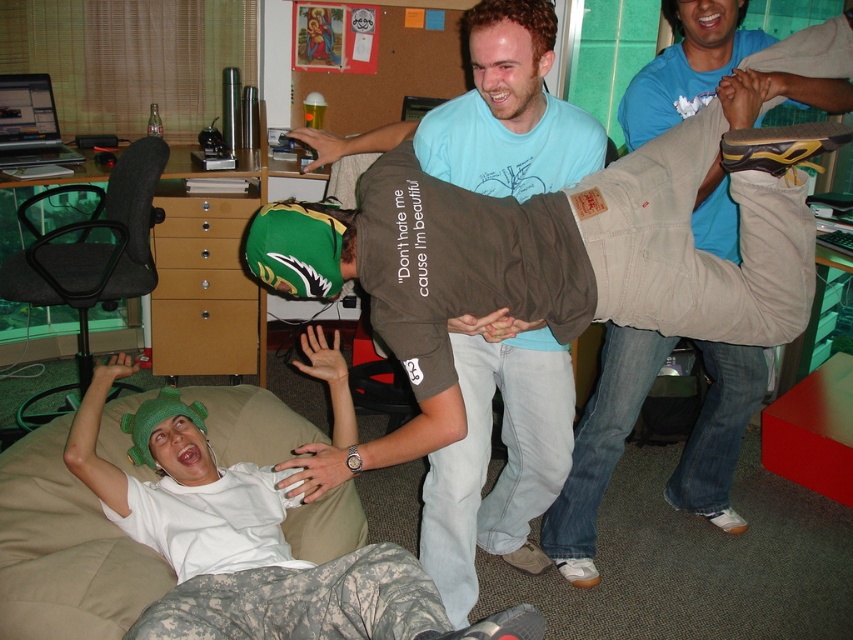
Question: Which object is farther from the camera taking this photo?

Choices:
 (A) beige fabric couch at lower left
 (B) khaki cotton pants at center
 (C) dark gray fabric bean bag chair at left

Answer: (C)

Question: Does khaki cotton pants at center appear on the left side of dark gray fabric bean bag chair at left?

Choices:
 (A) no
 (B) yes

Answer: (A)

Question: Does beige fabric couch at lower left have a larger size compared to dark gray fabric bean bag chair at left?

Choices:
 (A) no
 (B) yes

Answer: (A)

Question: Which point is farther from the camera taking this photo?

Choices:
 (A) (28, 268)
 (B) (717, 26)

Answer: (A)

Question: Which object is closer to the camera taking this photo?

Choices:
 (A) khaki cotton pants at center
 (B) dark gray fabric bean bag chair at left
 (C) beige fabric couch at lower left

Answer: (C)

Question: Is the position of khaki cotton pants at center less distant than that of dark gray fabric bean bag chair at left?

Choices:
 (A) no
 (B) yes

Answer: (B)